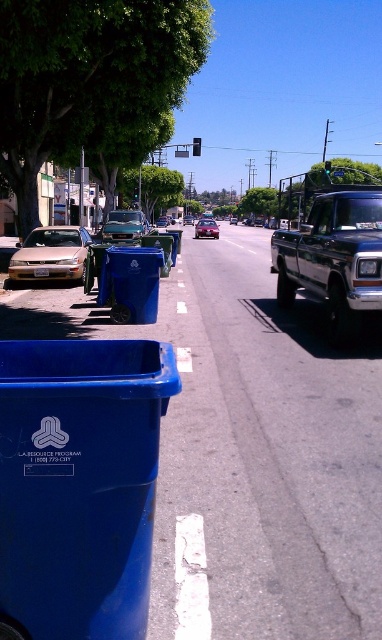
You are standing at the point with coordinates [134,284]. What object is located exactly at this point?

The blue plastic recycling bin at center is located exactly at the point [134,284].

You need to park your car which is 1.8 meters wide. You see a blue plastic recycling bin at center and a metallic silver car at center. Can you park your car between them without hitting either?

The blue plastic recycling bin at center is narrower than the metallic silver car at center. Since the recycling bin is narrower, there might be enough space between them to park your car. However, the exact distance isn not provided, so it depends on the actual gap between the two objects. If the combined width of the bin and the car allows for a 1.8 meter space between them, then yes, but without specific measurements, it is uncertain.